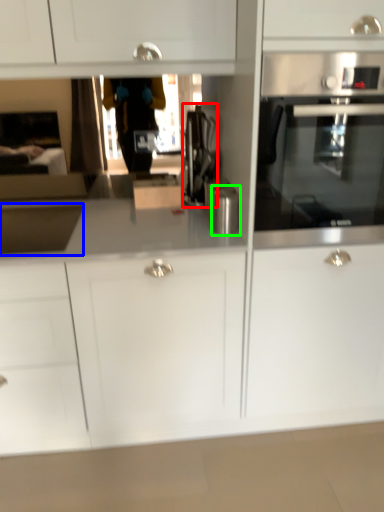
Question: Considering the real-world distances, which object is closest to coffee machine (highlighted by a red box)? sink (highlighted by a blue box) or kitchen appliance (highlighted by a green box).

Choices:
 (A) sink
 (B) kitchen appliance

Answer: (B)